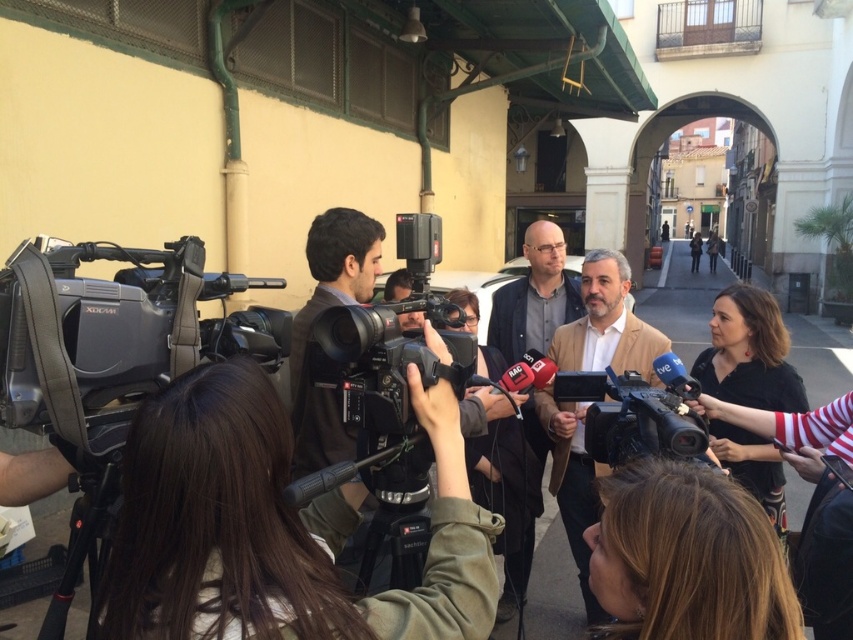
Does black matte camera at center appear on the left side of matte brown jacket at center?

Yes, black matte camera at center is to the left of matte brown jacket at center.

Who is shorter, black matte camera at center or matte brown jacket at center?

With less height is black matte camera at center.

Which is in front, point (374, 332) or point (555, 284)?

Point (374, 332) is in front.

This screenshot has height=640, width=853. I want to click on black matte camera at center, so click(x=381, y=362).

Is light brown suit at center positioned at the back of black matte camera at center?

Yes, light brown suit at center is behind black matte camera at center.

Can you confirm if light brown suit at center is positioned to the right of black matte camera at center?

Yes, light brown suit at center is to the right of black matte camera at center.

This screenshot has width=853, height=640. Identify the location of light brown suit at center. (607, 323).

Can you confirm if light brown suit at center is bigger than black plastic camera at center?

Indeed, light brown suit at center has a larger size compared to black plastic camera at center.

Measure the distance from light brown suit at center to black plastic camera at center.

light brown suit at center is 96.95 centimeters away from black plastic camera at center.

Between point (561, 465) and point (631, 374), which one is positioned in front?

Point (631, 374) is more forward.

This screenshot has width=853, height=640. What are the coordinates of `light brown suit at center` in the screenshot? It's located at (607, 323).